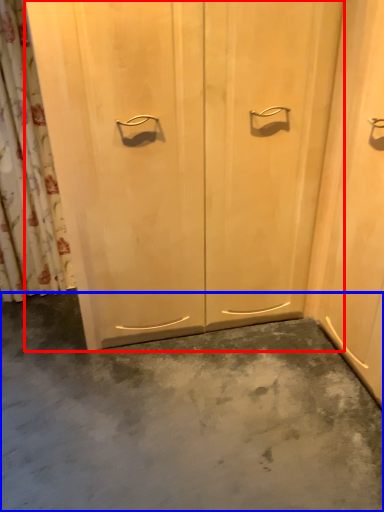
Question: Which of the following is the farthest to the observer, door (highlighted by a red box) or concrete (highlighted by a blue box)?

Choices:
 (A) door
 (B) concrete

Answer: (A)